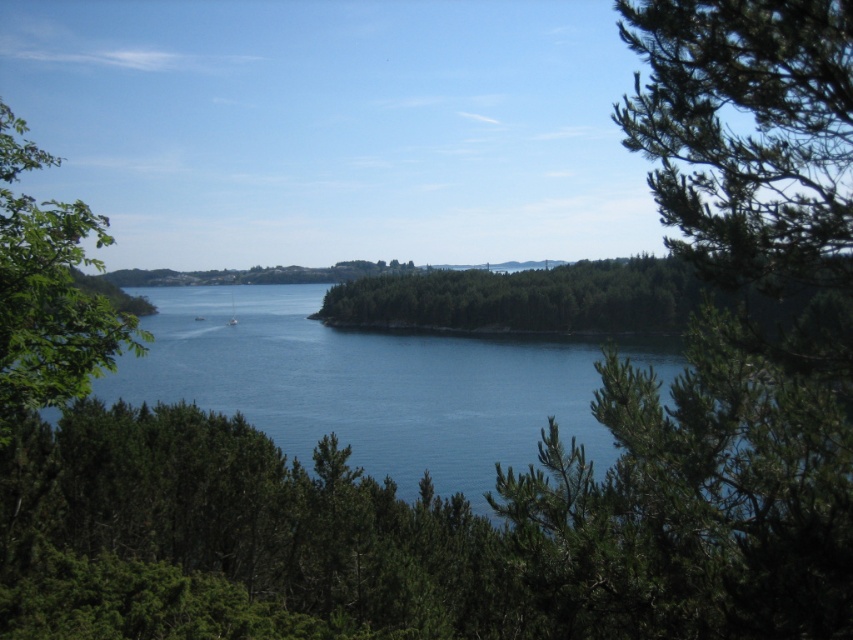
Who is positioned more to the left, blue water at center or green needle-like leaves at upper right?

blue water at center is more to the left.

Does blue water at center have a smaller size compared to green needle-like leaves at upper right?

Yes.

Between point (651, 356) and point (630, 125), which one is positioned in front?

Point (630, 125)

Where is `blue water at center`? blue water at center is located at coordinates (364, 385).

Is point (251, 376) in front of point (500, 328)?

Yes, it is.

Does point (328, 349) come in front of point (543, 296)?

Yes, point (328, 349) is closer to viewer.

This screenshot has height=640, width=853. In order to click on blue water at center in this screenshot , I will do `click(364, 385)`.

Who is more distant from viewer, (651,266) or (67,364)?

Positioned behind is point (651,266).

Is point (413, 276) positioned behind point (33, 392)?

Yes.

Where is `green leafy forest at center`? green leafy forest at center is located at coordinates (566, 300).